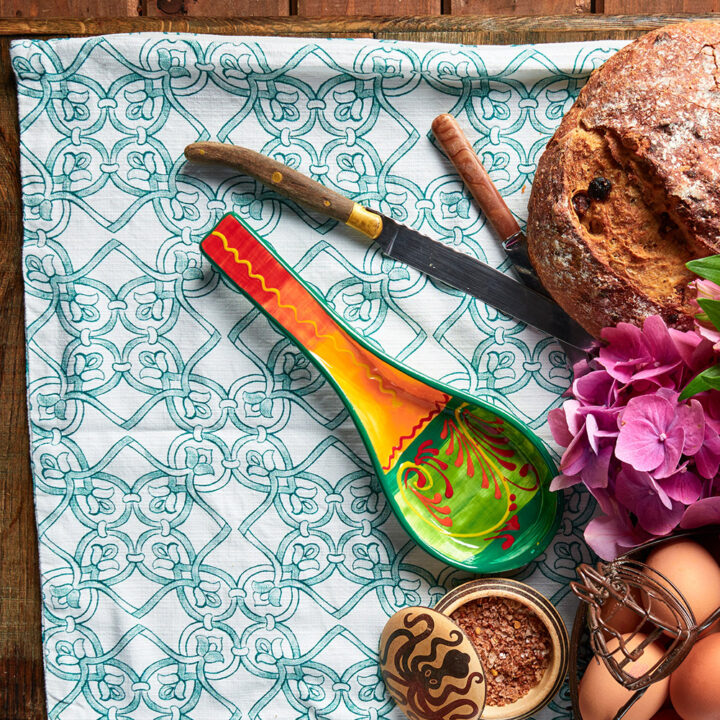
Where is `spanish spoon rest`? The image size is (720, 720). spanish spoon rest is located at coordinates coord(446,428).